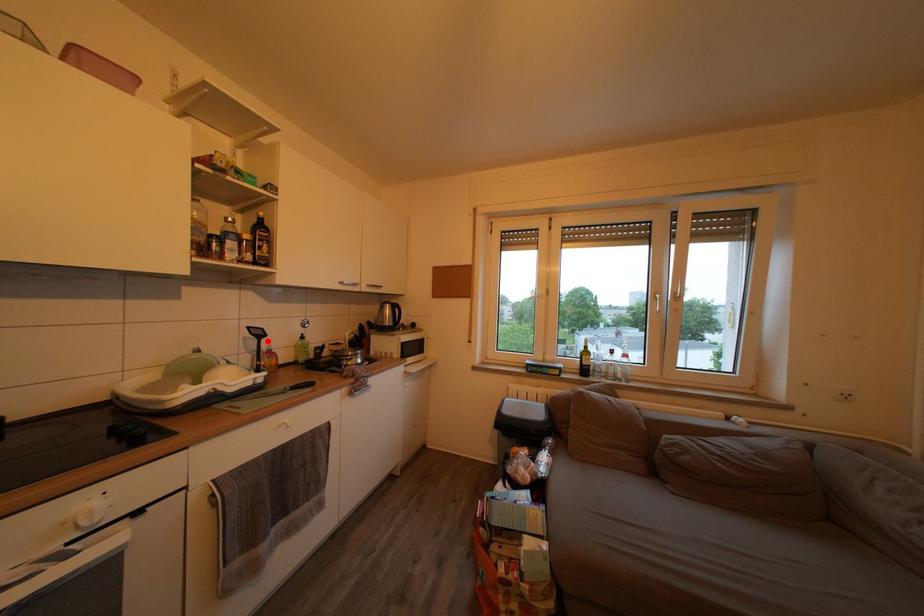
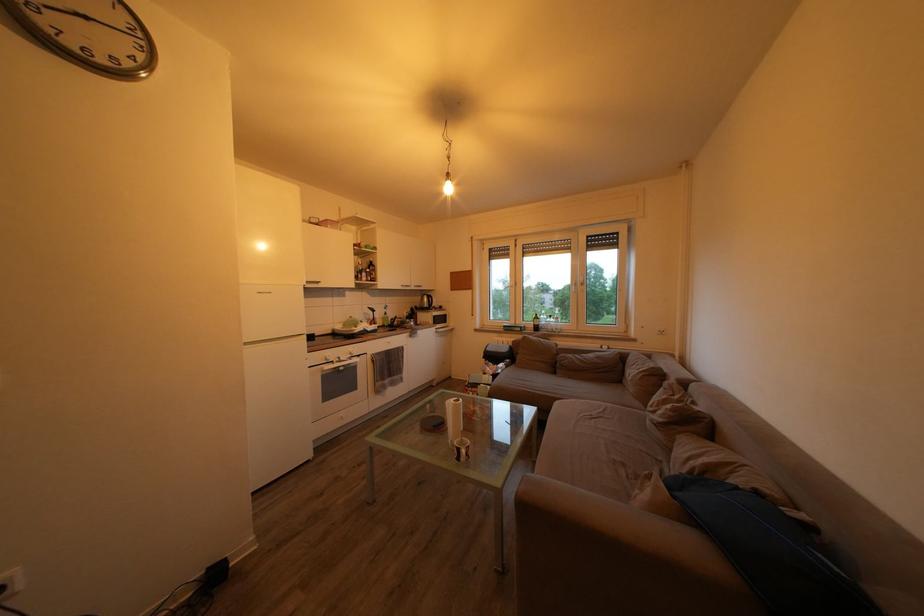
In the second image, find the point that corresponds to the highlighted location in the first image.

(381, 317)